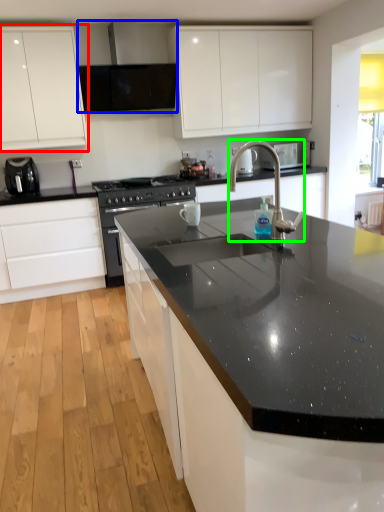
Question: Based on their relative distances, which object is nearer to cabinetry (highlighted by a red box)? Choose from exhaust hood (highlighted by a blue box) and tap (highlighted by a green box).

Choices:
 (A) exhaust hood
 (B) tap

Answer: (A)